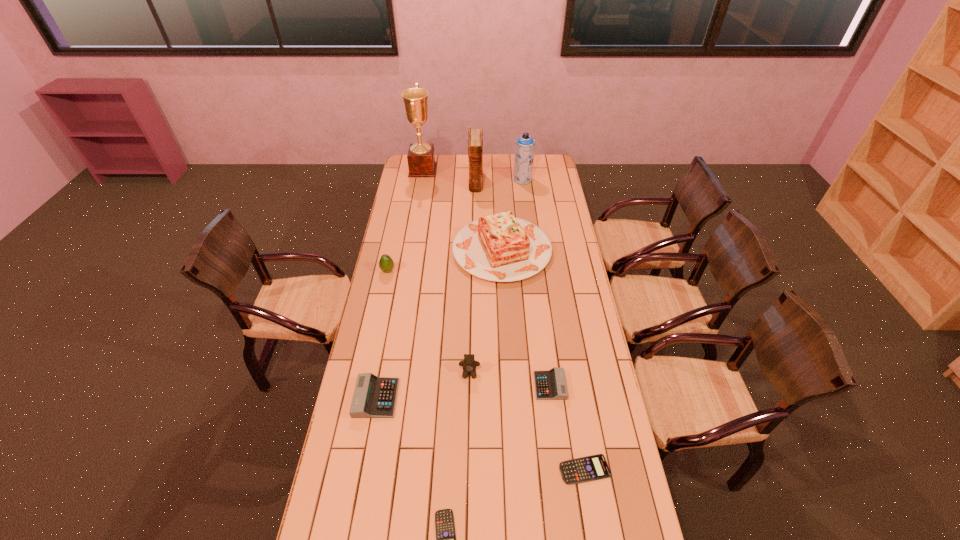
Image resolution: width=960 pixels, height=540 pixels. I want to click on vacant space located on the back of the eighth tallest object, so click(543, 334).

Locate an element on the screen. The width and height of the screenshot is (960, 540). free space located on the left of the farther blue calculator is located at coordinates (444, 469).

At what (x,y) coordinates should I click in order to perform the action: click on trophy cup situated at the far edge. Please return your answer as a coordinate pair (x, y). Looking at the image, I should click on (421, 157).

What are the coordinates of `hardback book that is at the far edge` in the screenshot? It's located at click(x=475, y=142).

Where is `aerosol can that is at the far edge`? aerosol can that is at the far edge is located at coordinates (525, 145).

The height and width of the screenshot is (540, 960). Find the location of `trophy cup present at the left edge`. trophy cup present at the left edge is located at coordinates (421, 157).

Image resolution: width=960 pixels, height=540 pixels. In order to click on avocado that is at the left edge in this screenshot , I will do `click(386, 264)`.

What are the coordinates of `calculator located in the left edge section of the desktop` in the screenshot? It's located at (374, 397).

You are a GUI agent. You are given a task and a screenshot of the screen. Output one action in this format:
    pyautogui.click(x=<x>, y=<y>)
    Task: Click on the aerosol can at the right edge
    
    Given the screenshot: What is the action you would take?
    pyautogui.click(x=525, y=145)

This screenshot has height=540, width=960. I want to click on lasagna that is positioned at the right edge, so click(x=500, y=247).